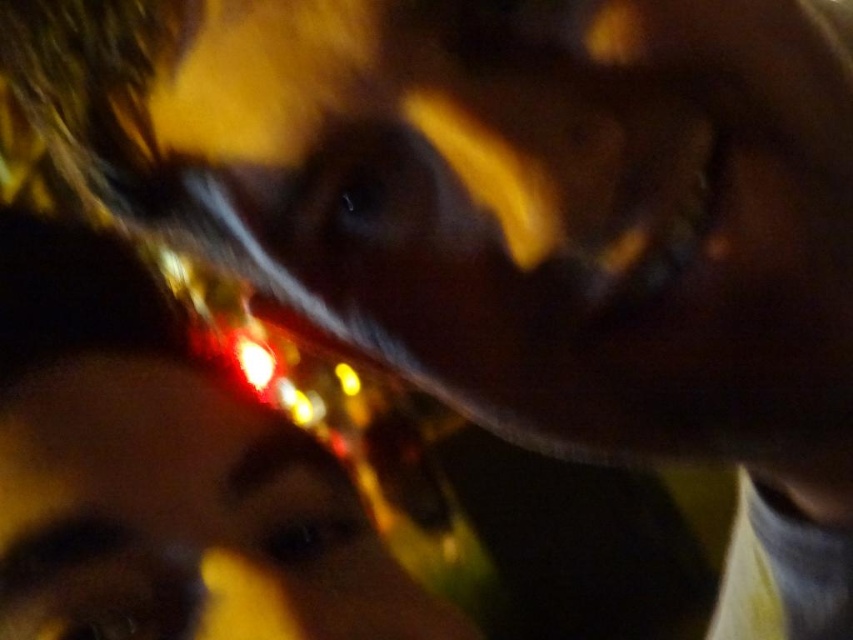
Consider the image. You are a photographer trying to capture a clear image of two glossy plastic faces in the scene. The glossy plastic face at center and the glossy plastic face at upper center. Given their sizes, which one is more likely to be in focus?

The glossy plastic face at center is larger, so it is more likely to be in focus compared to the glossy plastic face at upper center.

Based on the scene description, where is the glossy plastic face at center located in terms of coordinates?

The glossy plastic face at center is located at coordinates point (560, 216).

You are a photographer trying to adjust the focus on your camera. You notice two glossy plastic faces in your viewfinder. The glossy plastic face at center and the glossy plastic face at upper center. Which glossy plastic face is closer to the camera lens?

The glossy plastic face at center is closer to the camera lens because the glossy plastic face at upper center is behind it.